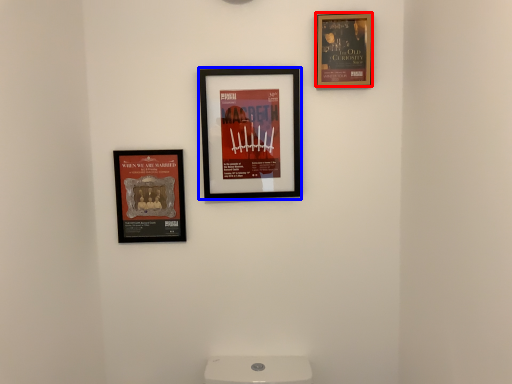
Question: Which point is closer to the camera, picture frame (highlighted by a red box) or picture frame (highlighted by a blue box)?

Choices:
 (A) picture frame
 (B) picture frame

Answer: (A)